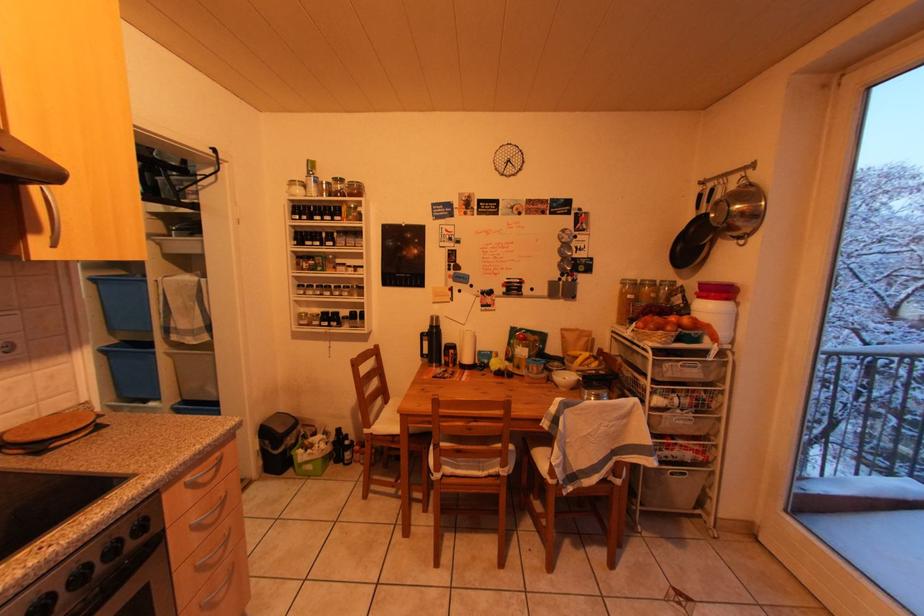
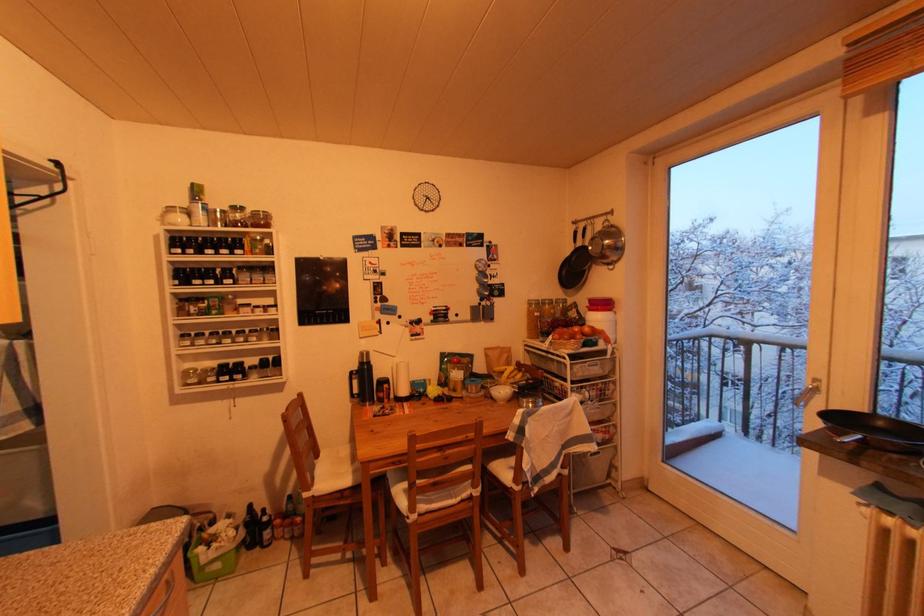
Question: Based on the continuous images, in which direction is the camera rotating? Reply with the corresponding letter.

Choices:
 (A) Left
 (B) Right
 (C) Up
 (D) Down

Answer: (B)